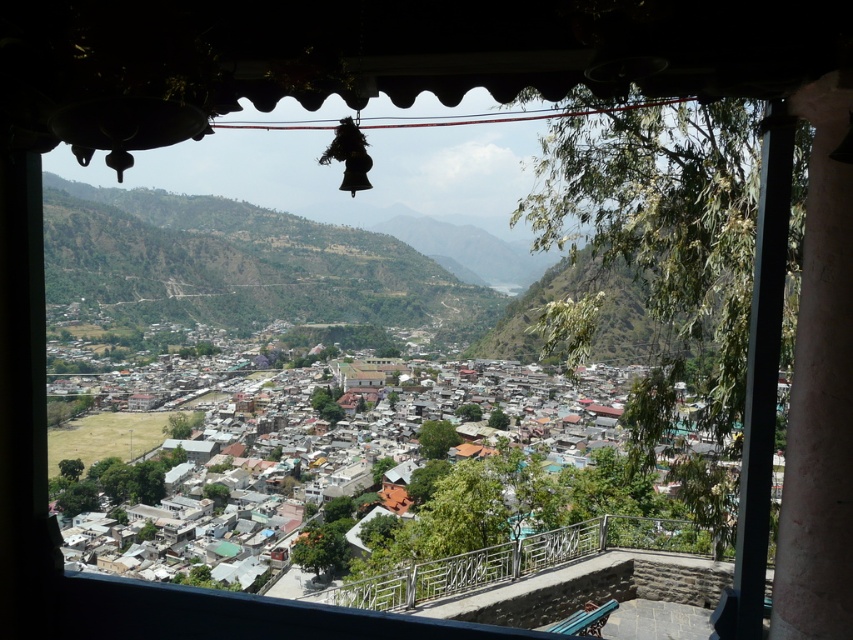
Question: Which object is farther from the camera taking this photo?

Choices:
 (A) metallic railing at lower center
 (B) rustic wooden houses at center

Answer: (B)

Question: Which object is farther from the camera taking this photo?

Choices:
 (A) rustic wooden houses at center
 (B) metallic railing at lower center

Answer: (A)

Question: Is rustic wooden houses at center below metallic railing at lower center?

Choices:
 (A) no
 (B) yes

Answer: (A)

Question: In this image, where is rustic wooden houses at center located relative to metallic railing at lower center?

Choices:
 (A) above
 (B) below

Answer: (A)

Question: Is rustic wooden houses at center below metallic railing at lower center?

Choices:
 (A) yes
 (B) no

Answer: (B)

Question: Which point is closer to the camera?

Choices:
 (A) (334, 476)
 (B) (368, 600)

Answer: (B)